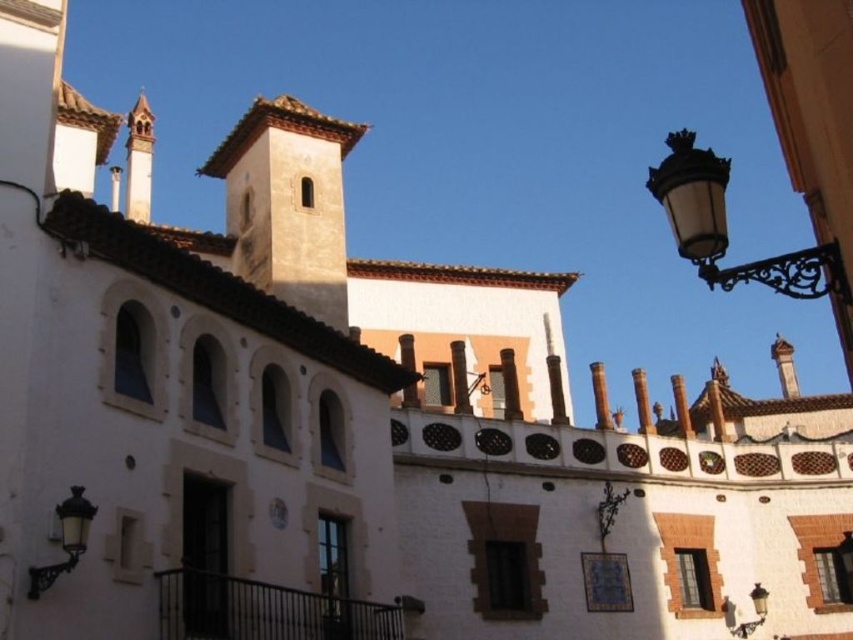
Question: Does black wrought iron streetlight at upper right have a smaller size compared to black glass streetlamp at lower right?

Choices:
 (A) yes
 (B) no

Answer: (B)

Question: Which of these objects is positioned farthest from the wooden spire at upper left?

Choices:
 (A) black wrought iron streetlight at upper right
 (B) brown textured tower at center

Answer: (A)

Question: Based on their relative distances, which object is farther from the black glass streetlamp at lower right?

Choices:
 (A) brown textured tower at center
 (B) matte black lamp at lower left
 (C) black wrought iron streetlight at upper right

Answer: (B)

Question: Which object is closer to the camera taking this photo?

Choices:
 (A) black glass streetlamp at lower right
 (B) metallic clock at center
 (C) wooden spire at upper left

Answer: (B)

Question: Can you confirm if matte black lamp at lower left is positioned below metallic clock at center?

Choices:
 (A) yes
 (B) no

Answer: (B)

Question: Observing the image, what is the correct spatial positioning of black wrought iron streetlight at upper right in reference to matte black lamp at lower left?

Choices:
 (A) right
 (B) left

Answer: (A)